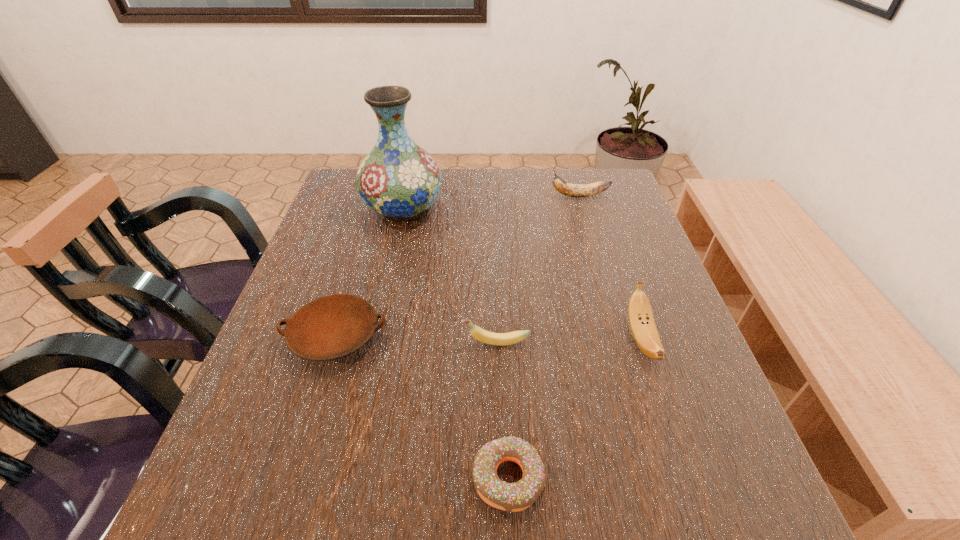
Find the location of a particular element. vacant space in between the farthest banana and the third shortest object is located at coordinates (538, 269).

At what (x,y) coordinates should I click in order to perform the action: click on object that stands as the third closest to the nearest object. Please return your answer as a coordinate pair (x, y). The width and height of the screenshot is (960, 540). Looking at the image, I should click on (641, 320).

Find the location of `object that is the fourth closest to the vase`. object that is the fourth closest to the vase is located at coordinates (641, 320).

Point out which banana is positioned as the second nearest to the nearest object. Please provide its 2D coordinates. Your answer should be formatted as a tuple, i.e. [(x, y)], where the tuple contains the x and y coordinates of a point satisfying the conditions above.

[(641, 320)]

Choose which banana is the nearest neighbor to the farthest banana. Please provide its 2D coordinates. Your answer should be formatted as a tuple, i.e. [(x, y)], where the tuple contains the x and y coordinates of a point satisfying the conditions above.

[(641, 320)]

What are the coordinates of `blank space that satisfies the following two spatial constraints: 1. at the stem of the leftmost banana; 2. on the left side of the doughnut` in the screenshot? It's located at (499, 478).

Image resolution: width=960 pixels, height=540 pixels. What are the coordinates of `free space that satisfies the following two spatial constraints: 1. on the peel of the farthest banana; 2. on the front side of the nearest object` in the screenshot? It's located at (663, 478).